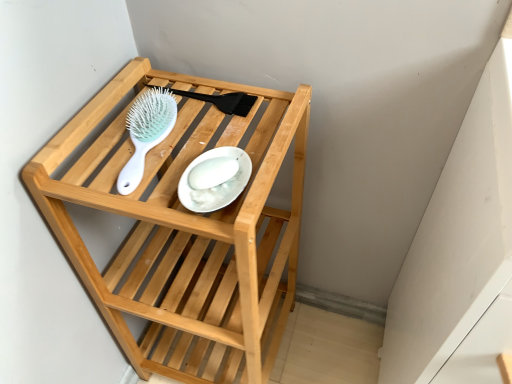
Question: From a real-world perspective, is white glossy plate at center above or below light blue plastic hairbrush at upper center?

Choices:
 (A) above
 (B) below

Answer: (A)

Question: Is point (214, 195) closer or farther from the camera than point (154, 142)?

Choices:
 (A) farther
 (B) closer

Answer: (B)

Question: Considering the real-world distances, which object is farthest from the light blue plastic hairbrush at upper center?

Choices:
 (A) white glossy plate at center
 (B) natural wood shelf at center

Answer: (B)

Question: Which of these objects is positioned farthest from the white glossy plate at center?

Choices:
 (A) light blue plastic hairbrush at upper center
 (B) natural wood shelf at center

Answer: (B)